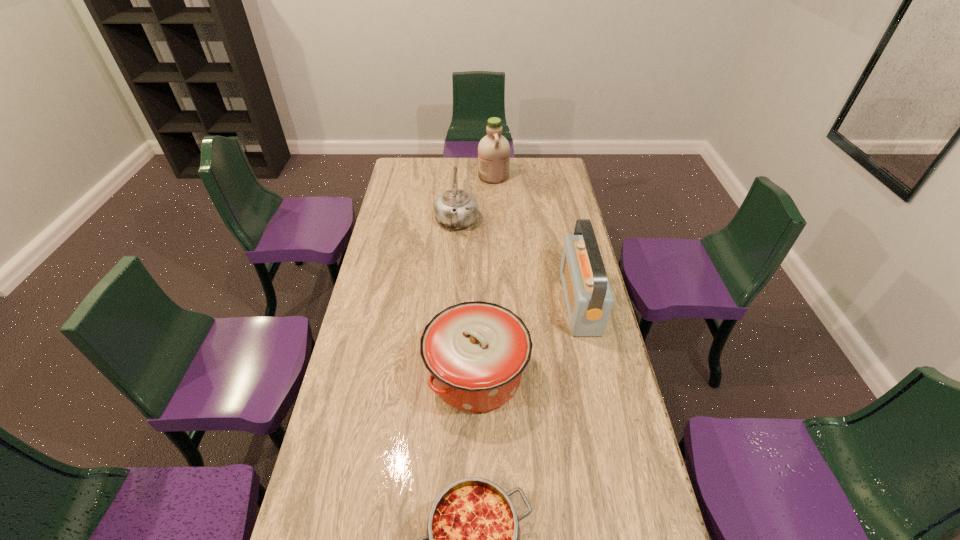
The image size is (960, 540). Identify the location of object that can be found as the closest to the cleansing agent. (456, 209).

Where is `object that ranks as the second closest to the radio receiver`? object that ranks as the second closest to the radio receiver is located at coordinates (456, 209).

Where is `free space that satisfies the following two spatial constraints: 1. at the spout of the fourth nearest object; 2. on the right side of the taller casserole`? The width and height of the screenshot is (960, 540). free space that satisfies the following two spatial constraints: 1. at the spout of the fourth nearest object; 2. on the right side of the taller casserole is located at coordinates (447, 374).

Find the location of a particular element. The width and height of the screenshot is (960, 540). vacant space that satisfies the following two spatial constraints: 1. on the front label of the farthest object; 2. at the spout of the kettle is located at coordinates (495, 223).

Locate an element on the screen. Image resolution: width=960 pixels, height=540 pixels. free location that satisfies the following two spatial constraints: 1. at the spout of the taller casserole; 2. on the right side of the kettle is located at coordinates (447, 374).

This screenshot has width=960, height=540. I want to click on vacant space that satisfies the following two spatial constraints: 1. on the front-facing side of the radio receiver; 2. on the front side of the farther casserole, so click(596, 374).

Identify the location of vacant space that satisfies the following two spatial constraints: 1. on the front label of the farthest object; 2. at the spout of the kettle. pyautogui.click(x=495, y=223).